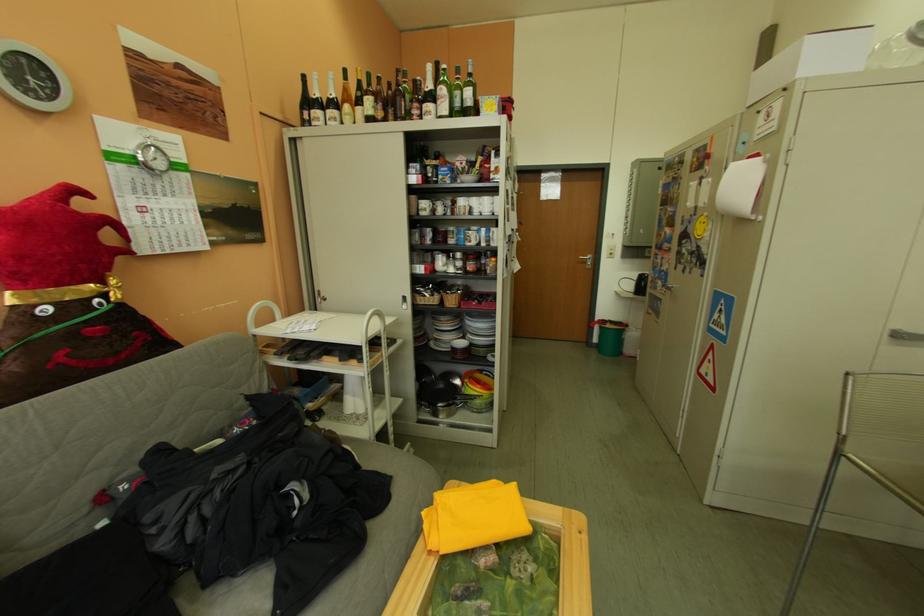
This screenshot has height=616, width=924. What do you see at coordinates (476, 267) in the screenshot? I see `the silver pan handle` at bounding box center [476, 267].